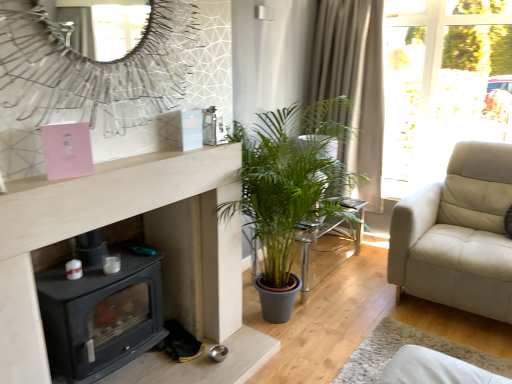
Where is `vacant area situated below translucent glass table at center (from a real-world perspective)`? vacant area situated below translucent glass table at center (from a real-world perspective) is located at coordinates (329, 253).